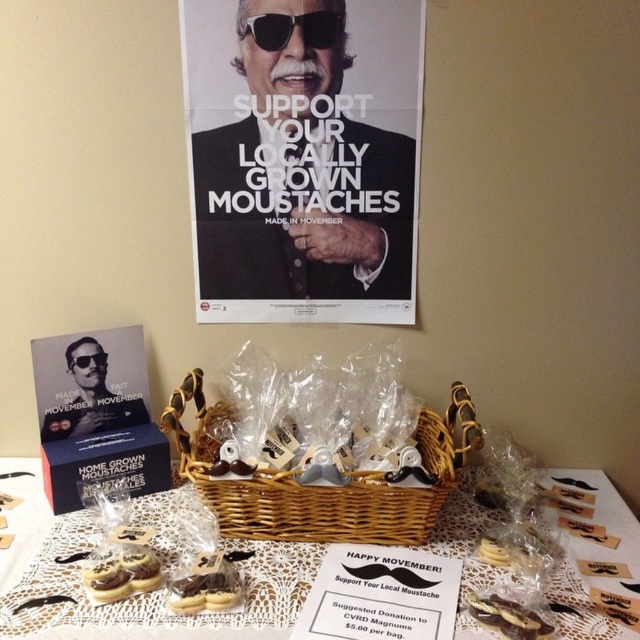
Who is positioned more to the left, chocolate-coated cookies at lower left or black matte goggles at upper left?

black matte goggles at upper left

The width and height of the screenshot is (640, 640). I want to click on chocolate-coated cookies at lower left, so click(120, 572).

Can you confirm if white lace tablecloth at center is taller than chocolate-coated cookies at lower left?

Correct, white lace tablecloth at center is much taller as chocolate-coated cookies at lower left.

You are a GUI agent. You are given a task and a screenshot of the screen. Output one action in this format:
    pyautogui.click(x=<x>, y=<y>)
    Task: Click on the white lace tablecloth at center
    The height and width of the screenshot is (640, 640).
    Given the screenshot: What is the action you would take?
    pyautogui.click(x=150, y=593)

Can you confirm if satin black poster at upper center is taller than black matte goggles at upper left?

Yes, satin black poster at upper center is taller than black matte goggles at upper left.

Can you confirm if satin black poster at upper center is smaller than black matte goggles at upper left?

Incorrect, satin black poster at upper center is not smaller in size than black matte goggles at upper left.

Who is more forward, (x=124, y=349) or (x=88, y=365)?

Point (x=88, y=365)

The image size is (640, 640). I want to click on satin black poster at upper center, so click(x=90, y=381).